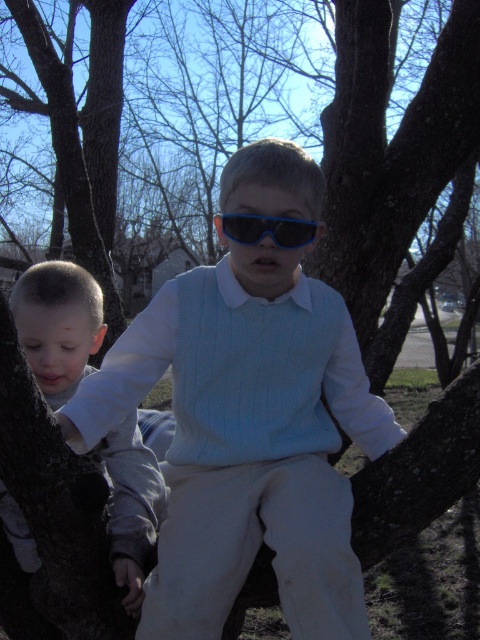
You are a photographer trying to capture a clear shot of both the light gray fleece shirt at left and the blue plastic goggles at center. Since you want to ensure both are fully visible in the frame, which object should you focus on first to account for their sizes?

The light gray fleece shirt at left has a greater height compared to the blue plastic goggles at center, so you should focus on the light gray fleece shirt at left first to ensure its full visibility before adjusting the frame for the smaller blue plastic goggles at center.